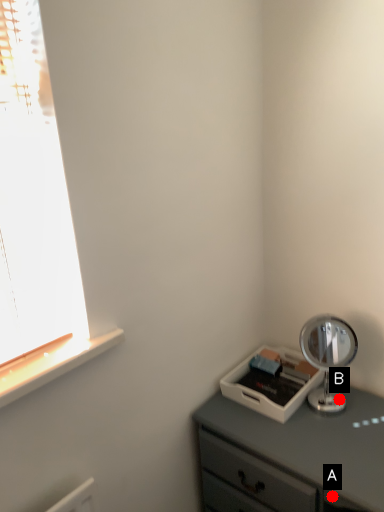
Question: Two points are circled on the image, labeled by A and B beside each circle. Which of the following is the closest to the observer?

Choices:
 (A) A is closer
 (B) B is closer

Answer: (A)